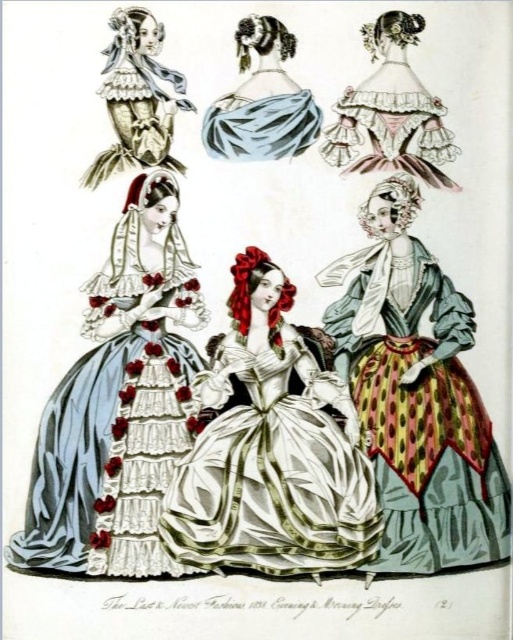
Question: Is silk satin gown with ruffles at center to the right of matte blue fabric at upper center from the viewer's perspective?

Choices:
 (A) yes
 (B) no

Answer: (B)

Question: Which of the following is the closest to the observer?

Choices:
 (A) (353, 100)
 (B) (301, 104)
 (C) (406, 474)
 (D) (262, 145)

Answer: (C)

Question: Among these points, which one is farthest from the camera?

Choices:
 (A) (478, 545)
 (B) (350, 500)
 (C) (165, 369)

Answer: (A)

Question: Considering the relative positions of polka dot silk skirt at center and matte pink fabric dress at upper right in the image provided, where is polka dot silk skirt at center located with respect to matte pink fabric dress at upper right?

Choices:
 (A) left
 (B) right

Answer: (B)

Question: Which point is farther from the camera taking this photo?

Choices:
 (A) (106, 74)
 (B) (367, 500)
 (C) (267, 157)

Answer: (A)

Question: Does matte pink fabric dress at upper right appear over matte white lace dress at upper left?

Choices:
 (A) no
 (B) yes

Answer: (B)